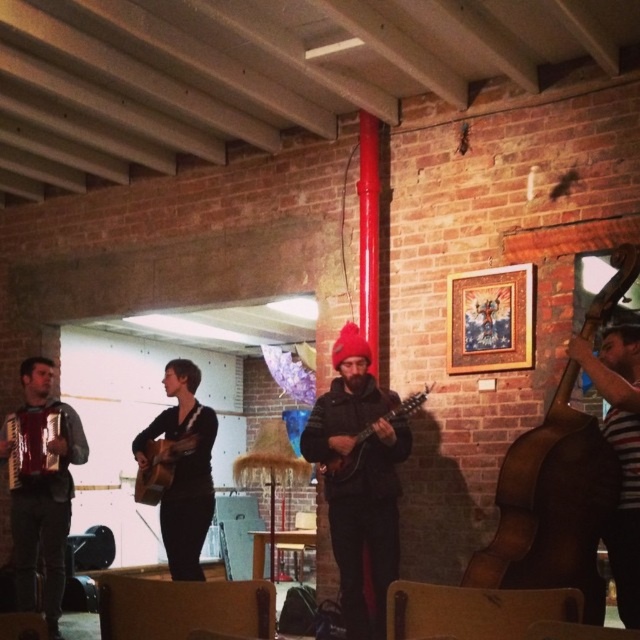
You are setting up a music stand between the black matte guitar at center and the striped fabric at right. Which side of the stand should be closer to the larger object?

The black matte guitar at center is larger than the striped fabric at right, so the music stand should position the side closer to the black matte guitar at center.

You are standing in the music venue and want to move closer to the point at coordinates point (8, 480). If you walk 10 feet towards it, how far will you be from the point?

After walking 10 feet towards the point at coordinates point (8, 480), you will be 19.12 minus 10 equals 9.12 feet away from it.